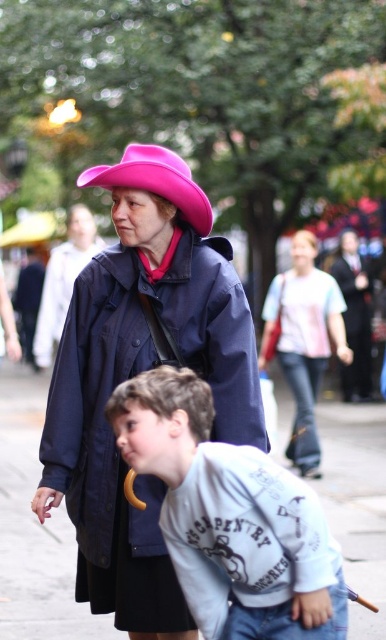
You are a delivery robot with a 1.2 meter wide package. You need to move through the space between the navy blue coat at center and the dark gray suit at center. Can you fit through the space between them?

The distance between the navy blue coat at center and the dark gray suit at center is 10.85 meters. Since the package is only 1.2 meters wide, there is more than enough space for the robot and its package to pass through safely.

You are standing on the street and see the navy blue coat at center and the dark gray suit at center. Which one appears taller from your viewpoint?

The dark gray suit at center appears taller than the navy blue coat at center because the navy blue coat at center is not as tall as dark gray suit at center.